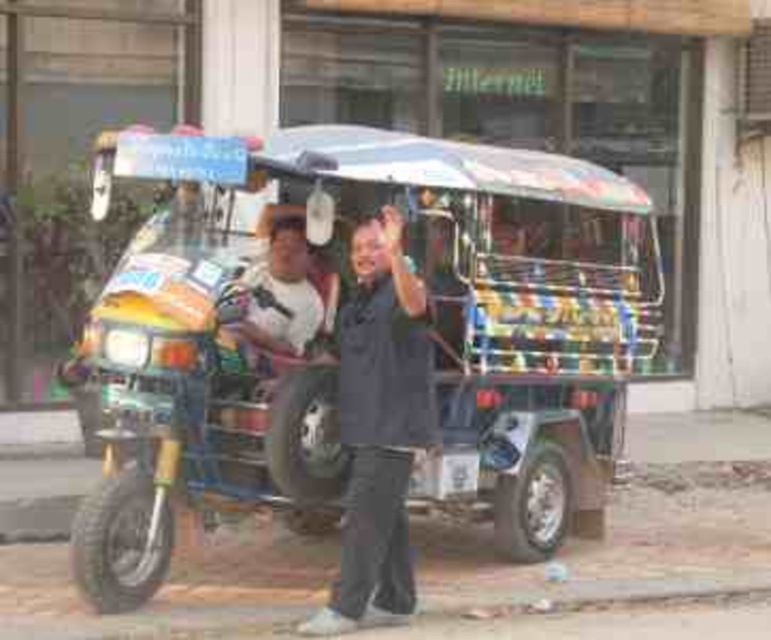
From the picture: Does multicolored painted cart at center have a greater width compared to dark gray fabric shirt at center?

Yes, multicolored painted cart at center is wider than dark gray fabric shirt at center.

Is multicolored painted cart at center to the right of dark gray fabric shirt at center from the viewer's perspective?

Yes, multicolored painted cart at center is to the right of dark gray fabric shirt at center.

The width and height of the screenshot is (771, 640). Identify the location of multicolored painted cart at center. (335, 339).

This screenshot has height=640, width=771. I want to click on multicolored painted cart at center, so click(x=335, y=339).